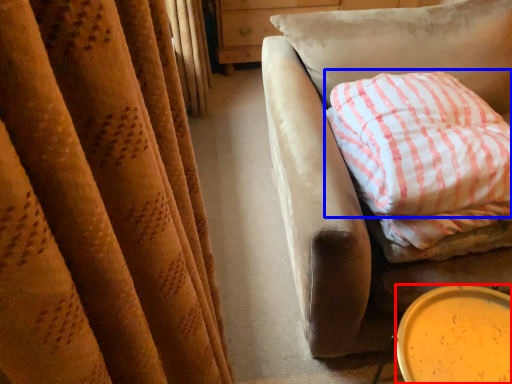
Question: Which of the following is the closest to the observer, beverage (highlighted by a red box) or pillow (highlighted by a blue box)?

Choices:
 (A) beverage
 (B) pillow

Answer: (A)